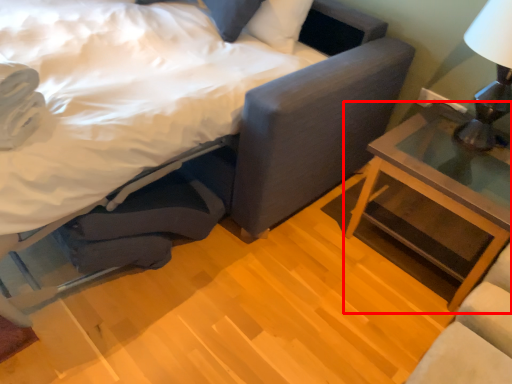
Question: From the image's perspective, where is nightstand (annotated by the red box) located in relation to bed in the image?

Choices:
 (A) below
 (B) above

Answer: (A)